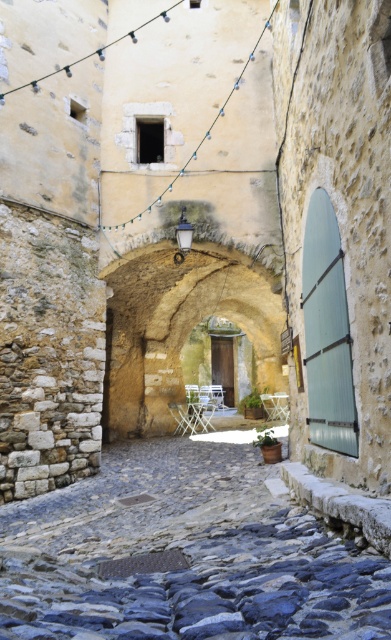
Which is behind, point (272, 532) or point (220, 307)?

The point (220, 307) is behind.

Is point (276, 596) more distant than point (139, 380)?

No, it is not.

Is point (111, 536) positioned before point (172, 396)?

Yes, point (111, 536) is in front of point (172, 396).

I want to click on smooth cobblestone alley at center, so 184,556.

Is smooth cobblestone alley at center below white plastic chair at center?

Incorrect, smooth cobblestone alley at center is not positioned below white plastic chair at center.

How far apart are smooth cobblestone alley at center and white plastic chair at center?

smooth cobblestone alley at center and white plastic chair at center are 16.96 meters apart.

You are a GUI agent. You are given a task and a screenshot of the screen. Output one action in this format:
    pyautogui.click(x=<x>, y=<y>)
    Task: Click on the smooth cobblestone alley at center
    
    Given the screenshot: What is the action you would take?
    pyautogui.click(x=184, y=556)

Where is `smooth cobblestone alley at center`? The image size is (391, 640). smooth cobblestone alley at center is located at coordinates (184, 556).

From the picture: Does smooth stone window at upper center appear under white plastic chair at center?

No.

Who is more distant from viewer, (272, 166) or (260, 396)?

The point (260, 396) is behind.

Between point (136, 205) and point (276, 406), which one is positioned behind?

The point (276, 406) is behind.

Locate an element on the screen. smooth stone window at upper center is located at coordinates (188, 124).